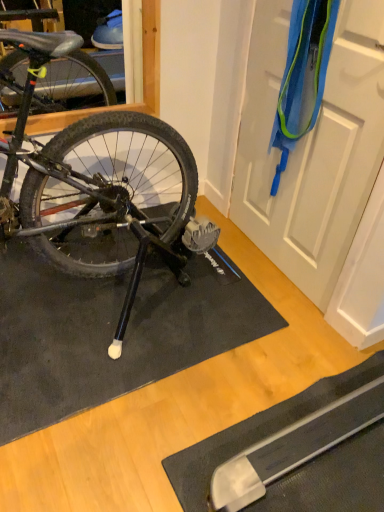
At what (x,y) coordinates should I click in order to perform the action: click on free space on the front side of white matte door at upper right. Please return your answer as a coordinate pair (x, y). This screenshot has height=512, width=384. Looking at the image, I should click on (268, 317).